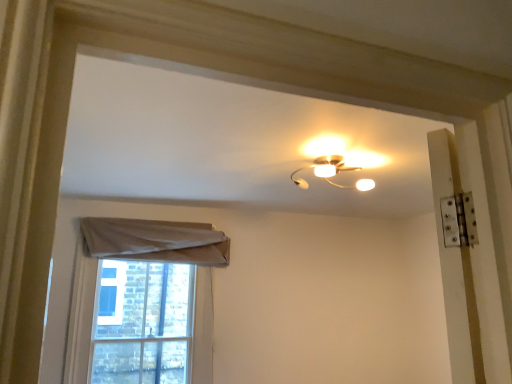
Question: Is matte white lamp at upper center bigger or smaller than light beige fabric at lower left?

Choices:
 (A) small
 (B) big

Answer: (A)

Question: From a real-world perspective, relative to light beige fabric at lower left, is matte white lamp at upper center vertically above or below?

Choices:
 (A) below
 (B) above

Answer: (B)

Question: In the image, is matte white lamp at upper center on the left side or the right side of light beige fabric at lower left?

Choices:
 (A) left
 (B) right

Answer: (B)

Question: From the image's perspective, is light beige fabric at lower left positioned above or below matte white lamp at upper center?

Choices:
 (A) above
 (B) below

Answer: (B)

Question: Is light beige fabric at lower left in front of or behind matte white lamp at upper center in the image?

Choices:
 (A) front
 (B) behind

Answer: (B)

Question: Considering the positions of light beige fabric at lower left and matte white lamp at upper center in the image, is light beige fabric at lower left taller or shorter than matte white lamp at upper center?

Choices:
 (A) tall
 (B) short

Answer: (A)

Question: In terms of size, does light beige fabric at lower left appear bigger or smaller than matte white lamp at upper center?

Choices:
 (A) big
 (B) small

Answer: (A)